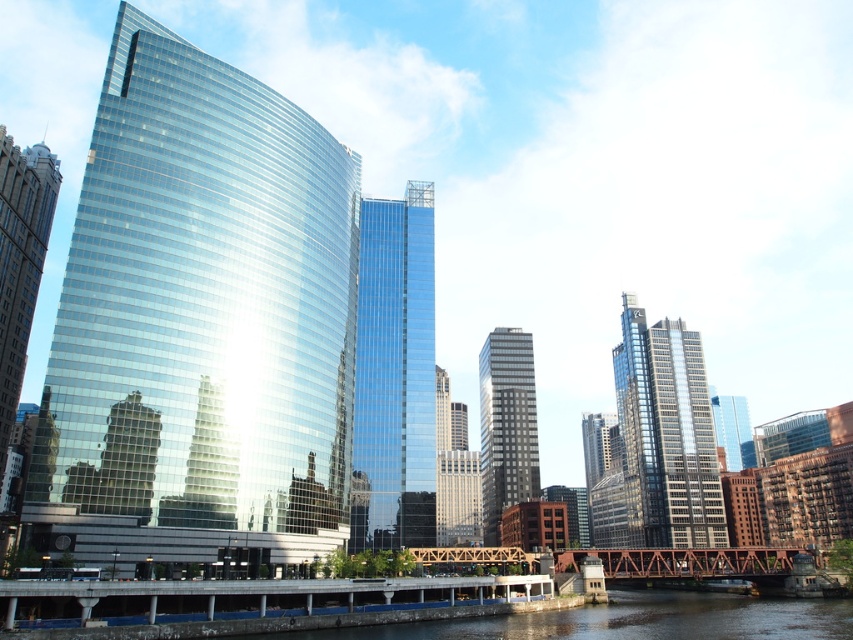
You are an architect evaluating the cityscape. You need to determine which of the two glass buildings, the shiny glass skyscraper at left or the glossy glass skyscraper at center, has a greater overall footprint. Based on their sizes as seen from this perspective, which one would you estimate occupies more ground space?

The shiny glass skyscraper at left is larger in size than the glossy glass skyscraper at center, so it likely has a greater footprint and occupies more ground space.

You are a city planner evaluating the skyline. You need to determine which of the two glass skyscrapers, the shiny glass skyscraper at left or the glossy glass skyscraper at center, is taller. Based on the image, which one is taller?

The shiny glass skyscraper at left is much taller than the glossy glass skyscraper at center, so the shiny glass skyscraper at left is taller.

You are a drone operator trying to capture a photo of the rusty steel bridge at lower center. However, the glossy glass skyscraper at center is blocking your view. Can you adjust your position to take the photo without the skyscraper obstructing the bridge?

The rusty steel bridge at lower center is behind the glossy glass skyscraper at center, so you can move to a position where the skyscraper is out of the frame or adjust your angle to capture the bridge without obstruction.